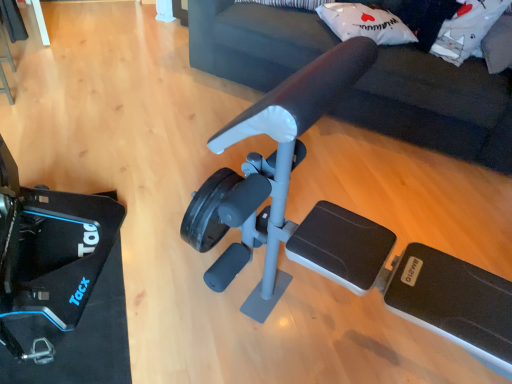
Question: Is matte black exercise machine at center in front of or behind white matte pillow at upper center, the 2th pillow in the right-to-left sequence, in the image?

Choices:
 (A) front
 (B) behind

Answer: (A)

Question: Based on their positions, is matte black exercise machine at center located to the left or right of white matte pillow at upper center, the 2th pillow in the right-to-left sequence?

Choices:
 (A) right
 (B) left

Answer: (A)

Question: Which of these objects is positioned farthest from the white soft pillow at upper right, which is the second pillow from left to right?

Choices:
 (A) matte black exercise machine at center
 (B) white matte pillow at upper center, positioned as the first pillow in left-to-right order
 (C) black matte tacx pedal at lower left

Answer: (C)

Question: Estimate the real-world distances between objects in this image. Which object is farther from the white matte pillow at upper center, positioned as the first pillow in left-to-right order?

Choices:
 (A) matte black exercise machine at center
 (B) white soft pillow at upper right, which is the first pillow in right-to-left order
 (C) black matte tacx pedal at lower left

Answer: (C)